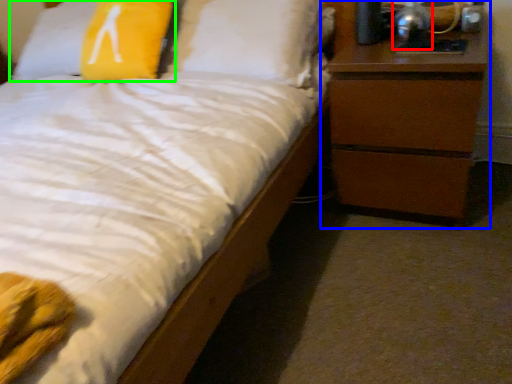
Question: Considering the real-world distances, which object is closest to bedside lamp (highlighted by a red box)? chest of drawers (highlighted by a blue box) or pillow (highlighted by a green box).

Choices:
 (A) chest of drawers
 (B) pillow

Answer: (A)